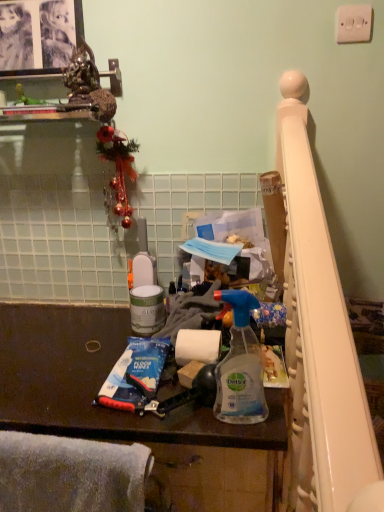
At what (x,y) coordinates should I click in order to perform the action: click on vacant position to the left of blue plastic toothpaste at lower center. Please return your answer as a coordinate pair (x, y). Looking at the image, I should click on (59, 376).